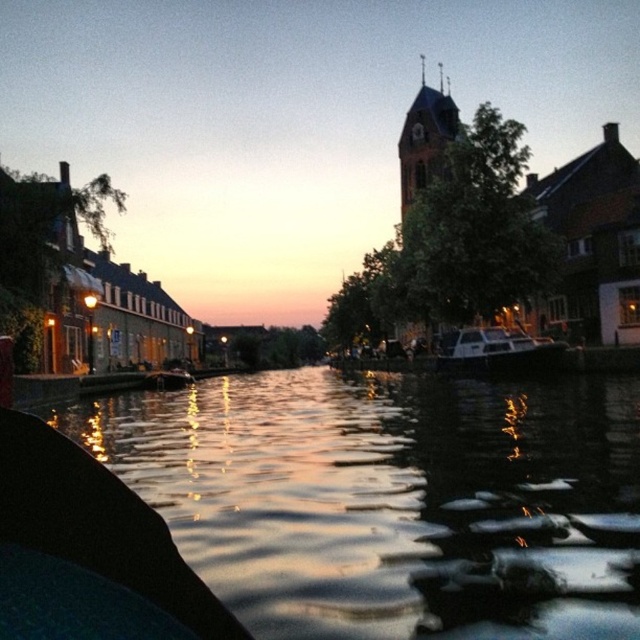
Who is taller, white matte boat at center or wooden boat at center?

With more height is white matte boat at center.

Is point (472, 349) farther from viewer compared to point (166, 374)?

No, it is not.

Image resolution: width=640 pixels, height=640 pixels. What do you see at coordinates (497, 352) in the screenshot?
I see `white matte boat at center` at bounding box center [497, 352].

Find the location of a particular element. The width and height of the screenshot is (640, 640). white matte boat at center is located at coordinates (497, 352).

Does silvery reflective water at center appear on the right side of wooden boat at center?

Yes, silvery reflective water at center is to the right of wooden boat at center.

Does silvery reflective water at center have a lesser width compared to wooden boat at center?

No.

Who is more distant from viewer, (368,586) or (157,384)?

Positioned behind is point (157,384).

You are a GUI agent. You are given a task and a screenshot of the screen. Output one action in this format:
    pyautogui.click(x=<x>, y=<y>)
    Task: Click on the silvery reflective water at center
    This screenshot has width=640, height=640.
    Given the screenshot: What is the action you would take?
    pyautogui.click(x=392, y=499)

Which is below, silvery reflective water at center or white matte boat at center?

silvery reflective water at center is below.

Is point (454, 506) in front of point (538, 337)?

Yes, point (454, 506) is in front of point (538, 337).

At what (x,y) coordinates should I click in order to perform the action: click on silvery reflective water at center. Please return your answer as a coordinate pair (x, y). This screenshot has height=640, width=640. Looking at the image, I should click on (392, 499).